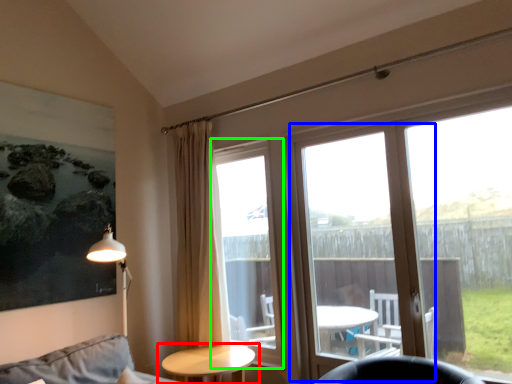
Question: Which object is the closest to the table (highlighted by a red box)? Choose among these: screen door (highlighted by a blue box) or bay window (highlighted by a green box).

Choices:
 (A) screen door
 (B) bay window

Answer: (B)